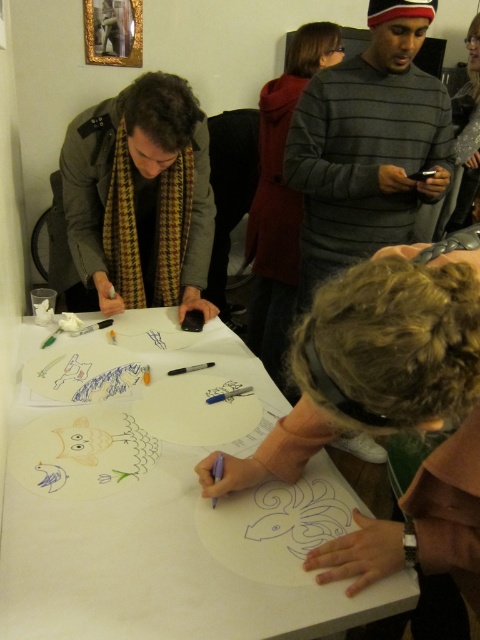
This screenshot has width=480, height=640. What do you see at coordinates (280, 198) in the screenshot? I see `red woolen coat at upper center` at bounding box center [280, 198].

Is point (271, 364) less distant than point (468, 211)?

Yes, point (271, 364) is in front of point (468, 211).

Where is `red woolen coat at upper center`? The height and width of the screenshot is (640, 480). red woolen coat at upper center is located at coordinates (280, 198).

Who is more forward, (314,504) or (148,376)?

Positioned in front is point (314,504).

Does blue ink fish at center appear on the left side of yellow wax crayon at center?

No, blue ink fish at center is not to the left of yellow wax crayon at center.

This screenshot has width=480, height=640. Find the location of `blue ink fish at center`. blue ink fish at center is located at coordinates (299, 515).

Which is behind, point (41, 445) or point (289, 275)?

Positioned behind is point (289, 275).

You are a GUI agent. You are given a task and a screenshot of the screen. Output one action in this format:
    pyautogui.click(x=<x>, y=<y>)
    Task: Click on the white paper at center
    Image resolution: width=480 pixels, height=640 pixels.
    Given the screenshot: What is the action you would take?
    (x=162, y=500)

Locate an element on the screen. The image size is (480, 640). white paper at center is located at coordinates (162, 500).

The image size is (480, 640). Find the location of `white paper at center`. white paper at center is located at coordinates (162, 500).